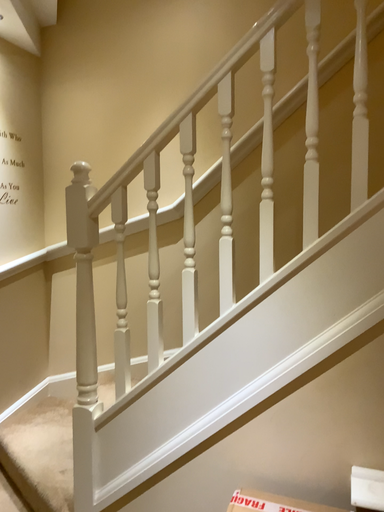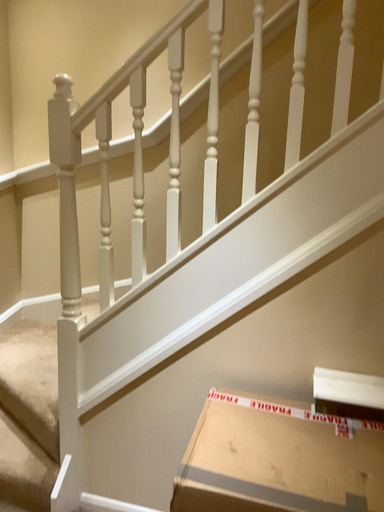
Question: Which way did the camera rotate in the video?

Choices:
 (A) rotated upward
 (B) rotated downward

Answer: (B)